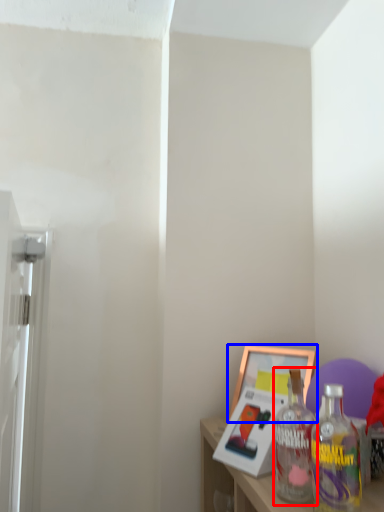
Question: Which object is closer to the camera taking this photo, bottle (highlighted by a red box) or picture frame (highlighted by a blue box)?

Choices:
 (A) bottle
 (B) picture frame

Answer: (A)